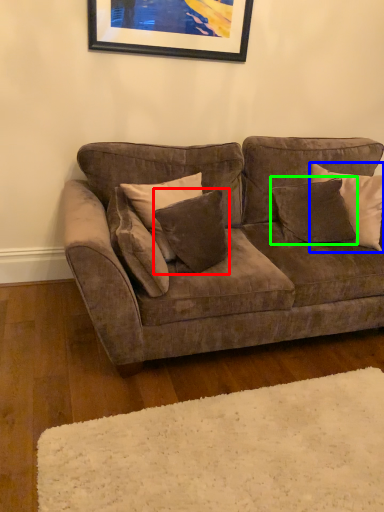
Question: Considering the real-world distances, which object is farthest from pillow (highlighted by a red box)? pillow (highlighted by a blue box) or pillow (highlighted by a green box)?

Choices:
 (A) pillow
 (B) pillow

Answer: (A)